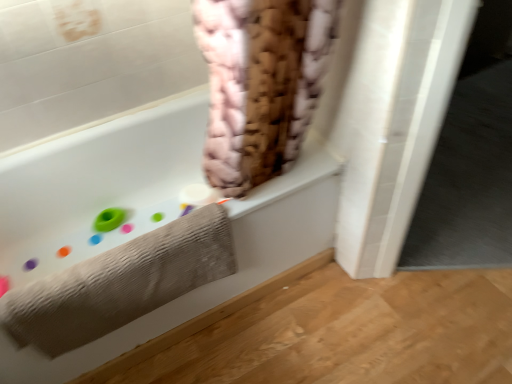
Question: Considering the positions of point (190, 187) and point (187, 225), is point (190, 187) closer or farther from the camera than point (187, 225)?

Choices:
 (A) closer
 (B) farther

Answer: (B)

Question: Considering their positions, is white matte toilet paper at upper center located in front of or behind gray textured towel at lower left?

Choices:
 (A) behind
 (B) front

Answer: (A)

Question: Which is farther from the white matte bathtub at upper left?

Choices:
 (A) gray textured towel at lower left
 (B) white matte toilet paper at upper center

Answer: (A)

Question: Which object is positioned closest to the white matte bathtub at upper left?

Choices:
 (A) white matte toilet paper at upper center
 (B) gray textured towel at lower left

Answer: (A)